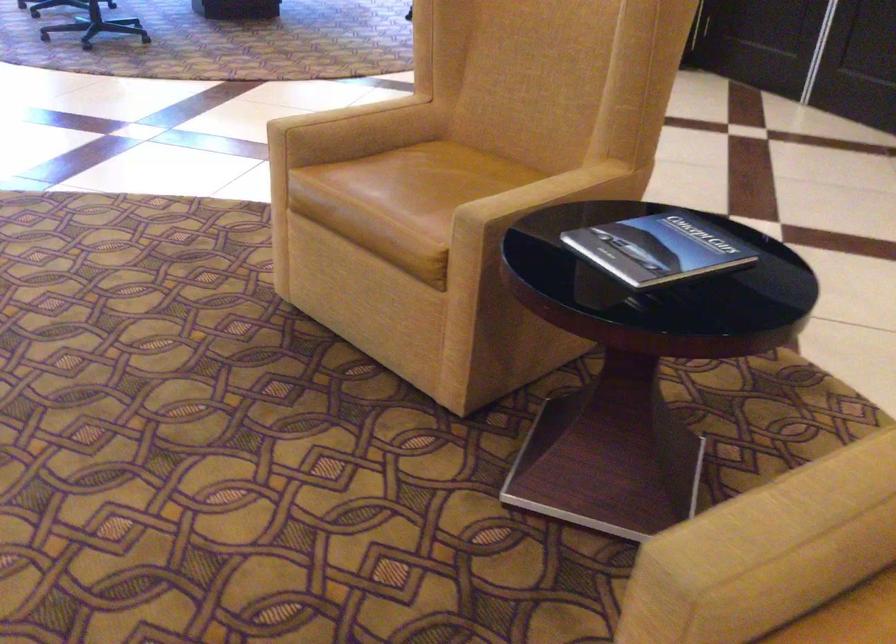
Where would you rest the chair armrest? Please return your answer as a coordinate pair (x, y).

(329, 100)